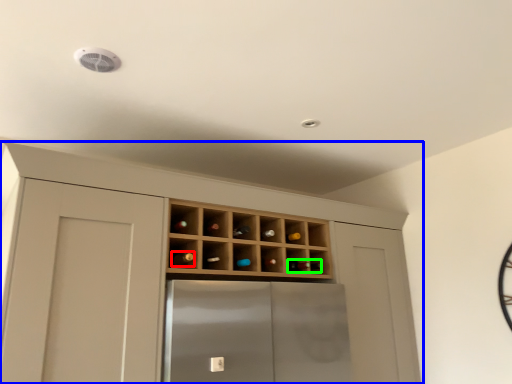
Question: Which object is positioned farthest from wine bottle (highlighted by a red box)? Select from cupboard (highlighted by a blue box) and wine bottle (highlighted by a green box).

Choices:
 (A) cupboard
 (B) wine bottle

Answer: (A)